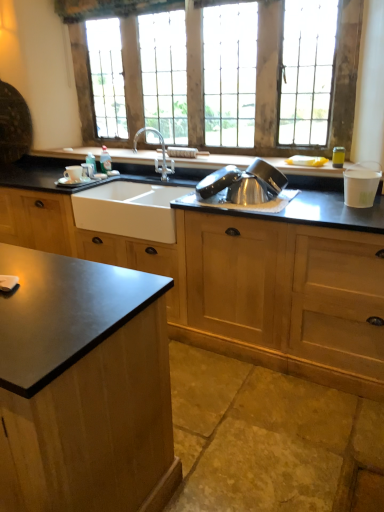
Locate an element on the screen. This screenshot has height=512, width=384. free location above white paper cup at right, which is counted as the 2th appliance, starting from the left (from a real-world perspective) is located at coordinates (360, 169).